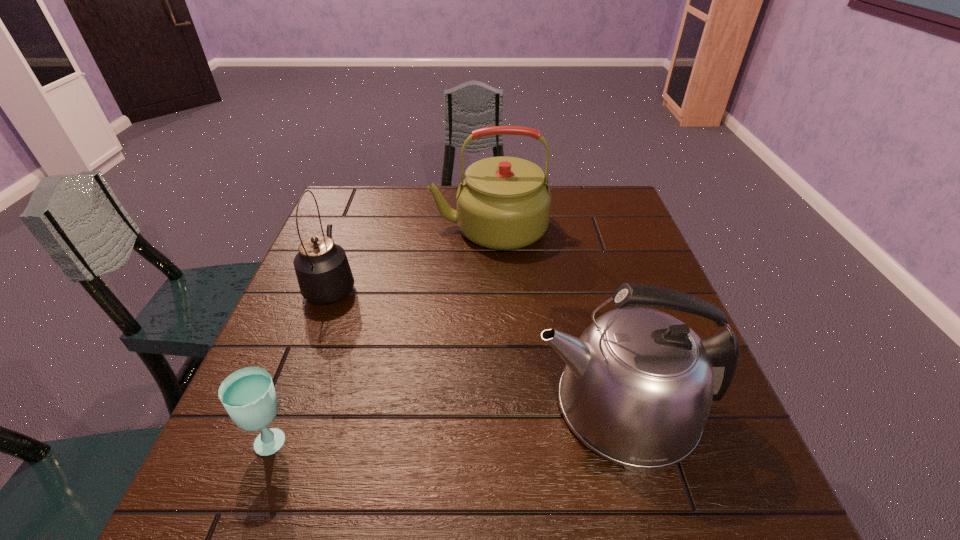
The width and height of the screenshot is (960, 540). Identify the location of the farthest kettle. (503, 203).

Locate an element on the screen. The width and height of the screenshot is (960, 540). the nearest kettle is located at coordinates (637, 388).

Identify the location of the leftmost kettle. This screenshot has height=540, width=960. (323, 272).

Where is `the second farthest object`? the second farthest object is located at coordinates (323, 272).

At what (x,y) coordinates should I click in order to perform the action: click on the shortest object. Please return your answer as a coordinate pair (x, y). Image resolution: width=960 pixels, height=540 pixels. Looking at the image, I should click on (248, 394).

Where is `vacant position located 0.100m at the spout of the farthest object`? This screenshot has height=540, width=960. vacant position located 0.100m at the spout of the farthest object is located at coordinates (396, 228).

This screenshot has height=540, width=960. What are the coordinates of `free space located at the spout of the farthest object` in the screenshot? It's located at (399, 228).

Locate an element on the screen. free space located 0.150m at the spout of the farthest object is located at coordinates (379, 228).

You are a GUI agent. You are given a task and a screenshot of the screen. Output one action in this format:
    pyautogui.click(x=<x>, y=<y>)
    Task: Click on the blank space located on the spout of the nearest kettle
    The height and width of the screenshot is (540, 960).
    Given the screenshot: What is the action you would take?
    pyautogui.click(x=495, y=406)

Find the location of a particular element. This screenshot has width=960, height=540. vacant position located 0.070m on the spout of the nearest kettle is located at coordinates (495, 406).